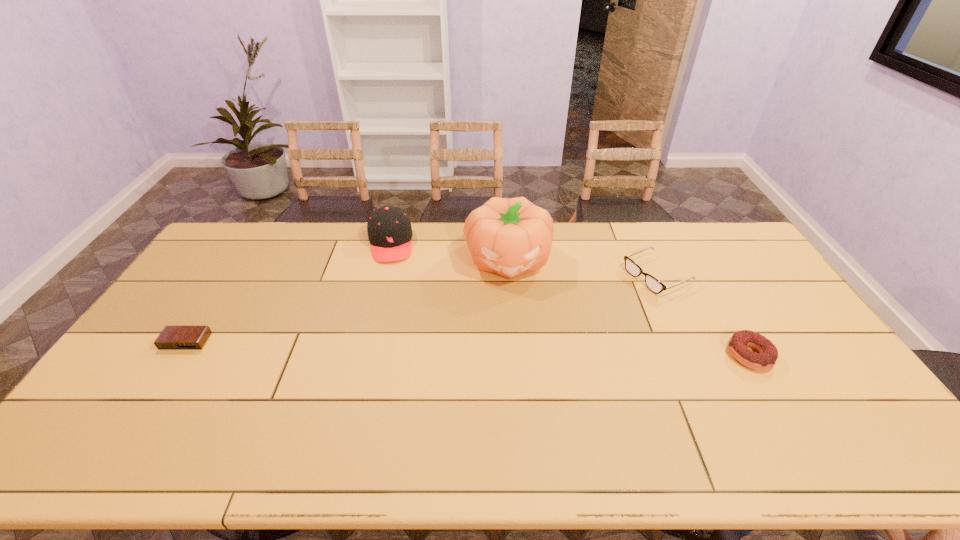
Identify the location of alarm clock. The width and height of the screenshot is (960, 540). (172, 337).

Find the location of a particular element. Image resolution: width=960 pixels, height=540 pixels. the shortest object is located at coordinates (172, 337).

Locate an element on the screen. Image resolution: width=960 pixels, height=540 pixels. doughnut is located at coordinates (737, 345).

Where is `the tallest object`? The height and width of the screenshot is (540, 960). the tallest object is located at coordinates (509, 237).

Find the location of a particular element. Image resolution: width=960 pixels, height=540 pixels. the third object from left to right is located at coordinates (509, 237).

You are a GUI agent. You are given a task and a screenshot of the screen. Output one action in this format:
    pyautogui.click(x=<x>, y=<y>)
    Task: Click on the spectacles
    This screenshot has height=540, width=960.
    Given the screenshot: What is the action you would take?
    pyautogui.click(x=653, y=284)

The height and width of the screenshot is (540, 960). In order to click on the fourth object from right to left in this screenshot , I will do `click(389, 229)`.

Locate an element on the screen. cap is located at coordinates (389, 229).

This screenshot has height=540, width=960. Identify the location of vacant area situated 0.230m on the front face of the shortest object. (132, 422).

Identify the location of vacant position located 0.080m on the front of the doughnut. (775, 399).